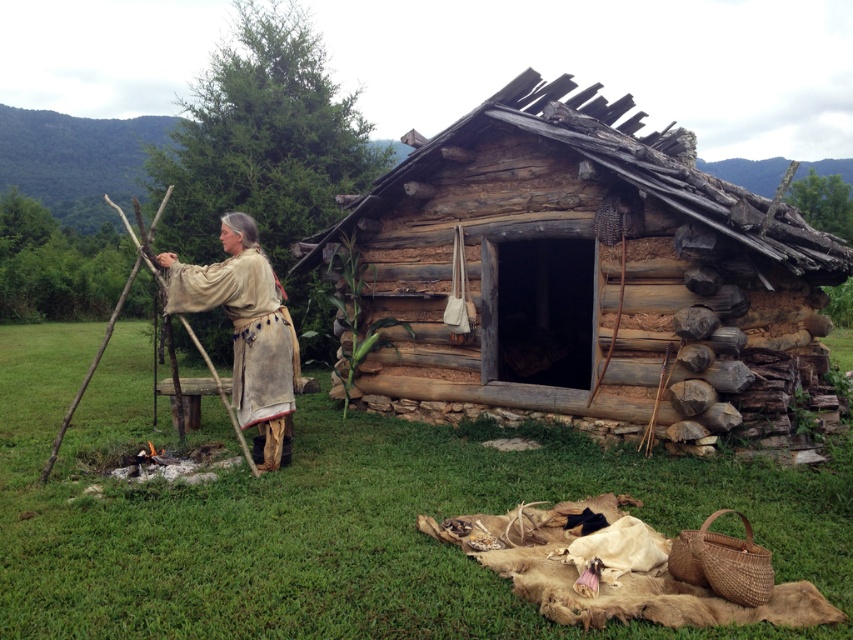
Who is lower down, weathered wood cabin at center or beige leather robe at center?

beige leather robe at center is below.

The width and height of the screenshot is (853, 640). Identify the location of weathered wood cabin at center. (590, 278).

Which is behind, point (654, 204) or point (190, 266)?

Point (190, 266)

Locate an element on the screen. The image size is (853, 640). weathered wood cabin at center is located at coordinates (590, 278).